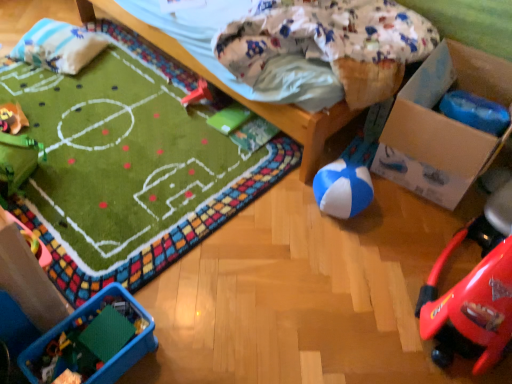
Question: From a real-world perspective, is cardboard box at lower right beneath plush yellow duck at upper left, marked as the 2th toy in a back-to-front arrangement?

Choices:
 (A) no
 (B) yes

Answer: (A)

Question: Is cardboard box at lower right facing away from plush yellow duck at upper left, which is counted as the third toy, starting from the front?

Choices:
 (A) yes
 (B) no

Answer: (B)

Question: Considering the relative sizes of cardboard box at lower right and plush yellow duck at upper left, which is counted as the fourth toy, starting from the right, in the image provided, is cardboard box at lower right thinner than plush yellow duck at upper left, which is counted as the fourth toy, starting from the right,?

Choices:
 (A) yes
 (B) no

Answer: (B)

Question: Does cardboard box at lower right have a larger size compared to plush yellow duck at upper left, which is counted as the third toy, starting from the front?

Choices:
 (A) no
 (B) yes

Answer: (B)

Question: Is there a large distance between cardboard box at lower right and plush yellow duck at upper left, which is counted as the fourth toy, starting from the right?

Choices:
 (A) yes
 (B) no

Answer: (A)

Question: Could you tell me if cardboard box at lower right is turned towards plush yellow duck at upper left, marked as the 2th toy in a back-to-front arrangement?

Choices:
 (A) no
 (B) yes

Answer: (A)

Question: Does plush yellow duck at upper left, which is the first toy in left-to-right order, contain rubberized red car at center, marked as the 4th toy in a bottom-to-top arrangement?

Choices:
 (A) no
 (B) yes

Answer: (A)

Question: Considering the relative sizes of plush yellow duck at upper left, which is counted as the fourth toy, starting from the right, and rubberized red car at center, placed as the fourth toy when sorted from front to back, in the image provided, is plush yellow duck at upper left, which is counted as the fourth toy, starting from the right, thinner than rubberized red car at center, placed as the fourth toy when sorted from front to back,?

Choices:
 (A) no
 (B) yes

Answer: (A)

Question: Is plush yellow duck at upper left, which is counted as the third toy, starting from the front, aimed at rubberized red car at center, placed as the fourth toy when sorted from front to back?

Choices:
 (A) no
 (B) yes

Answer: (A)

Question: Is plush yellow duck at upper left, which is the first toy in left-to-right order, taller than rubberized red car at center, marked as the 4th toy in a bottom-to-top arrangement?

Choices:
 (A) no
 (B) yes

Answer: (A)

Question: Is the position of plush yellow duck at upper left, which is counted as the third toy, starting from the front, more distant than that of rubberized red car at center, acting as the 3th toy starting from the left?

Choices:
 (A) no
 (B) yes

Answer: (A)

Question: Is plush yellow duck at upper left, which is counted as the third toy, starting from the front, not near rubberized red car at center, marked as the 4th toy in a bottom-to-top arrangement?

Choices:
 (A) yes
 (B) no

Answer: (B)

Question: From the image's perspective, is plush yellow duck at upper left, positioned as the 2th toy in top-to-bottom order, on white soft pillow at upper left?

Choices:
 (A) yes
 (B) no

Answer: (B)